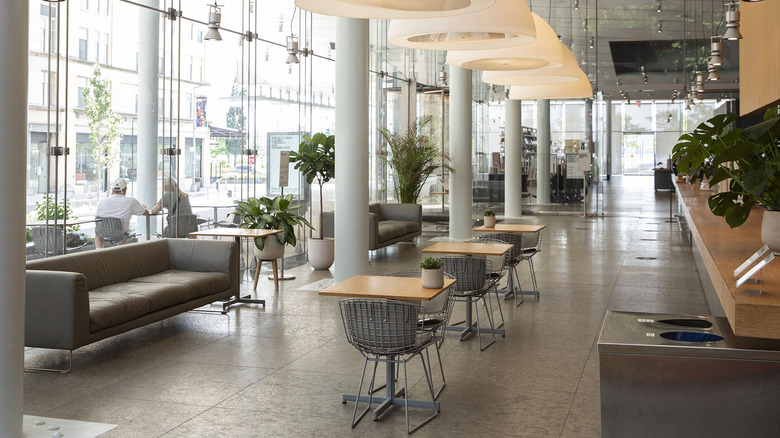
In order to click on hanging lights in this screenshot , I will do `click(409, 13)`, `click(477, 12)`, `click(512, 49)`, `click(551, 76)`, `click(569, 84)`.